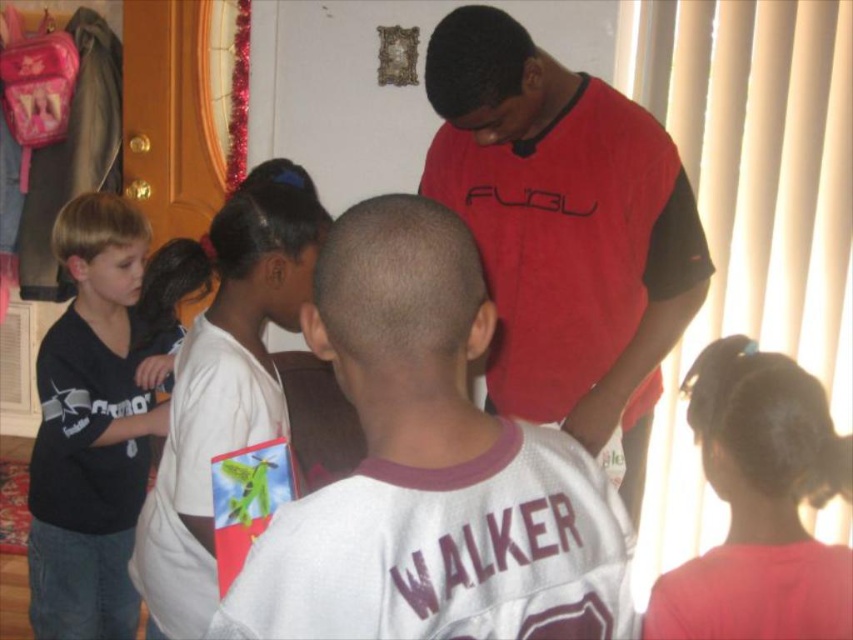
You are a photographer trying to capture a group shot of the children. Since you want to ensure that all subjects are clearly visible, you need to adjust the camera focus. Given that the white jersey at center is smaller in size than the black matte shirt at left, which child should you focus on first to ensure the smaller subject is in sharp focus?

You should focus on the white jersey at center first because it has a smaller size compared to the black matte shirt at left, ensuring the smaller subject is in sharp focus.

Looking at this image, you are a photographer trying to capture a group photo of the children in the scene. Based on their positions, which child should you ask to move forward to ensure both the white matte shirt at upper left and the dark brown hair at upper right are in focus?

The white matte shirt at upper left is much taller than the dark brown hair at upper right. To ensure both are in focus, you should ask the child with the dark brown hair at upper right to move forward closer to the height of the white matte shirt at upper left.